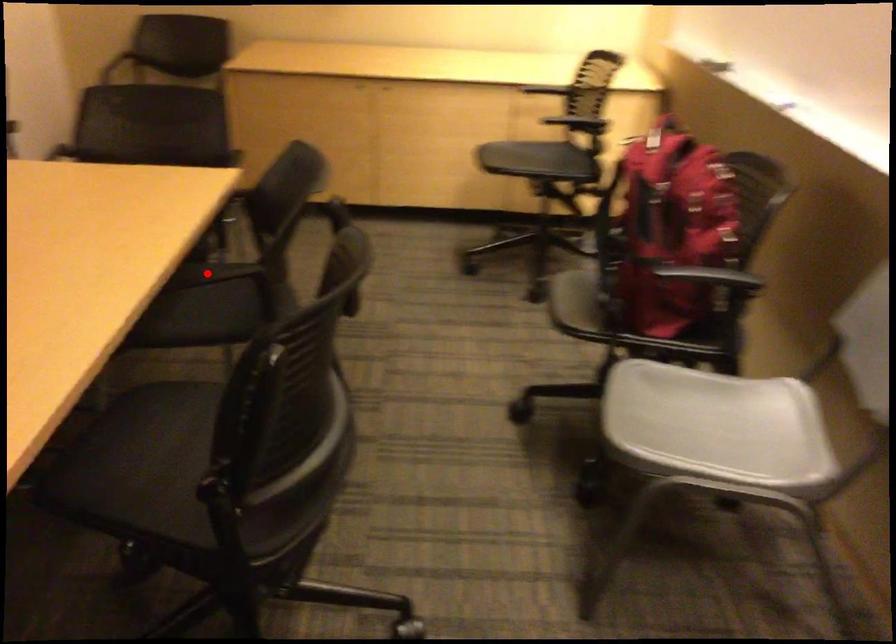
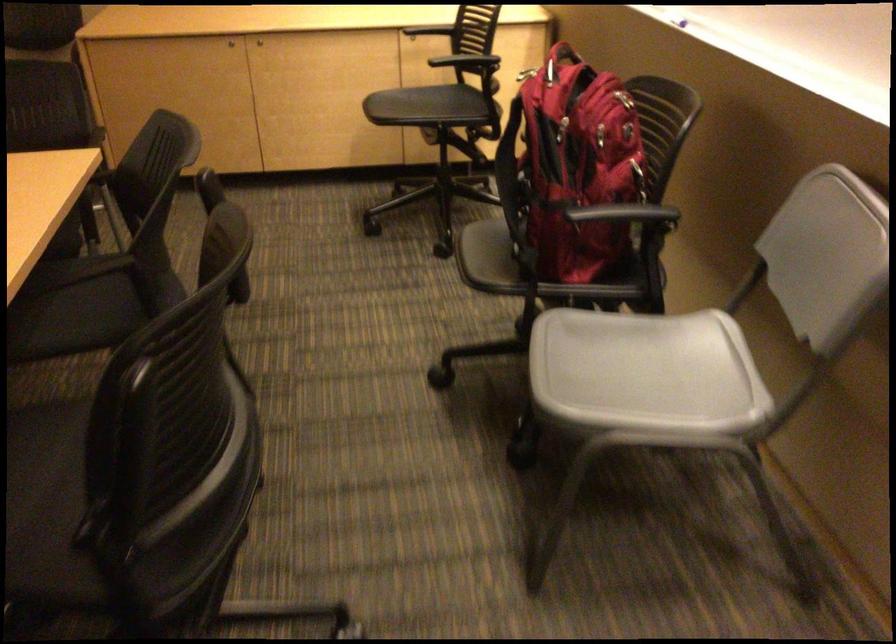
Question: I am providing you with two images of the same scene from different viewpoints. Image1 has a red point marked. In image2, the corresponding 3D location appears at what relative position? Reply with the corresponding letter.

Choices:
 (A) Closer
 (B) Farther

Answer: (A)